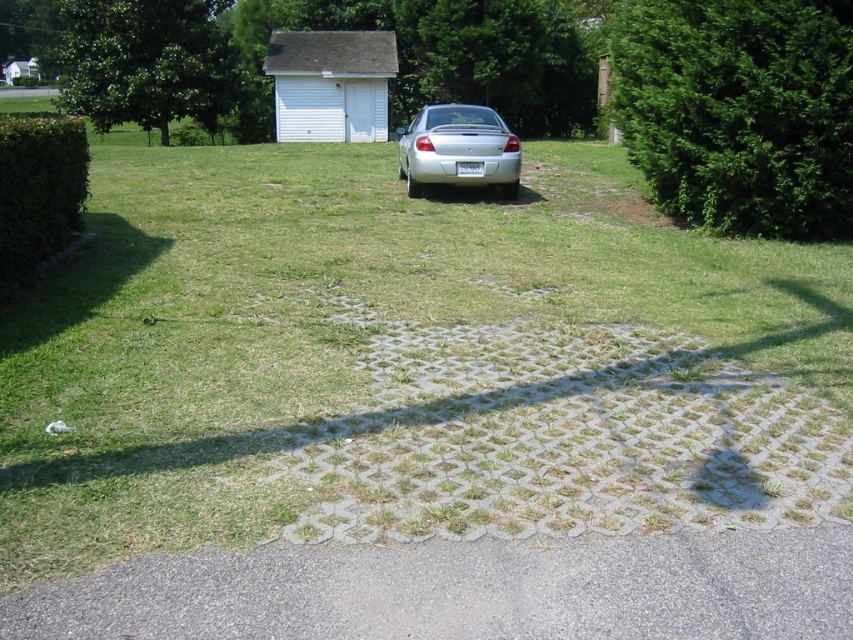
Question: Estimate the real-world distances between objects in this image. Which object is closer to the silver metallic car at center?

Choices:
 (A) green leafy hedge at right
 (B) gray asphalt driveway at lower center
 (C) green leafy hedge at left

Answer: (A)

Question: Does green leafy hedge at right have a lesser width compared to green leafy hedge at left?

Choices:
 (A) yes
 (B) no

Answer: (A)

Question: Does gray asphalt driveway at lower center appear on the right side of green leafy hedge at right?

Choices:
 (A) yes
 (B) no

Answer: (B)

Question: Estimate the real-world distances between objects in this image. Which object is closer to the gray asphalt driveway at lower center?

Choices:
 (A) silver metallic car at center
 (B) green leafy hedge at right

Answer: (B)

Question: Among these points, which one is farthest from the camera?

Choices:
 (A) (469, 180)
 (B) (210, 595)
 (C) (785, 6)
 (D) (54, 184)

Answer: (A)

Question: Is gray asphalt driveway at lower center bigger than green leafy hedge at left?

Choices:
 (A) no
 (B) yes

Answer: (A)